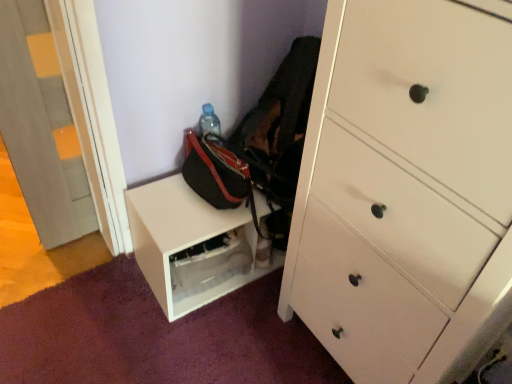
Question: From their relative heights in the image, would you say white matte shelf at lower center is taller or shorter than matte gray door at left?

Choices:
 (A) short
 (B) tall

Answer: (A)

Question: Considering the positions of white matte shelf at lower center and matte gray door at left in the image, is white matte shelf at lower center wider or thinner than matte gray door at left?

Choices:
 (A) thin
 (B) wide

Answer: (B)

Question: Estimate the real-world distances between objects in this image. Which object is farther from the matte gray door at left?

Choices:
 (A) white wood chest of drawers at right
 (B) white matte shelf at lower center
 (C) black fabric messenger bag at lower center

Answer: (A)

Question: Estimate the real-world distances between objects in this image. Which object is closer to the black fabric messenger bag at lower center?

Choices:
 (A) white matte shelf at lower center
 (B) white wood chest of drawers at right
 (C) matte gray door at left

Answer: (A)